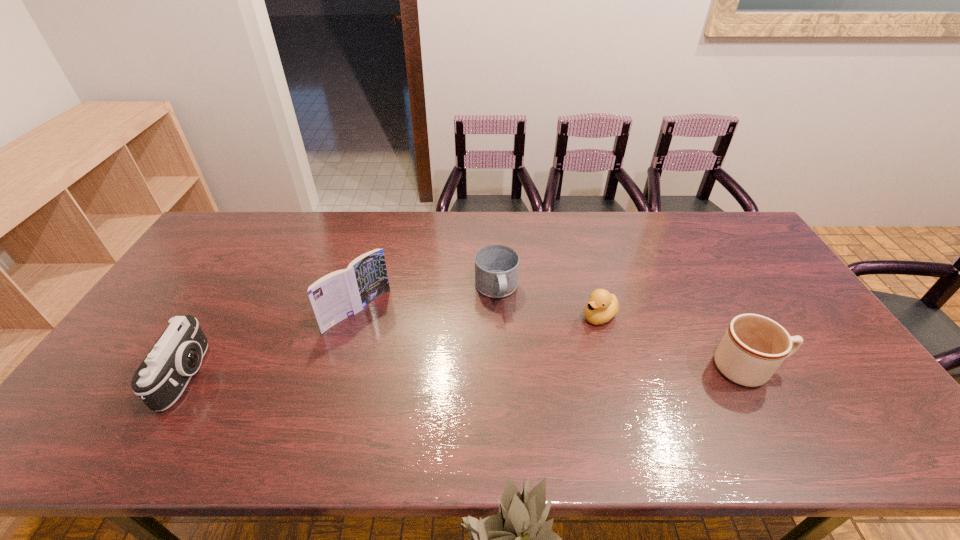
Locate an element on the screen. the leftmost object is located at coordinates (163, 375).

This screenshot has height=540, width=960. Find the location of `the taller mug`. the taller mug is located at coordinates [x=753, y=347].

Find the location of a particular element. Image resolution: width=960 pixels, height=540 pixels. the rightmost object is located at coordinates (753, 347).

Locate an element on the screen. the tallest object is located at coordinates (338, 295).

Locate an element on the screen. Image resolution: width=960 pixels, height=540 pixels. the second object from left to right is located at coordinates (338, 295).

The height and width of the screenshot is (540, 960). Find the location of `the shorter mug`. the shorter mug is located at coordinates (496, 266).

What are the coordinates of `the farther mug` in the screenshot? It's located at (496, 266).

In order to click on the fourth object from left to right in this screenshot , I will do `click(602, 307)`.

The image size is (960, 540). In order to click on vacant space located 0.270m on the front lens of the leftmost object in this screenshot , I will do `click(312, 374)`.

Where is `vacant space located on the side of the taller mug with the handle`? The image size is (960, 540). vacant space located on the side of the taller mug with the handle is located at coordinates (814, 368).